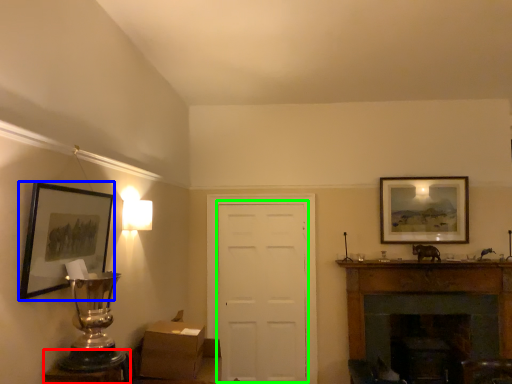
Question: Which object is positioned farthest from table (highlighted by a red box)? Select from picture frame (highlighted by a blue box) and door (highlighted by a green box).

Choices:
 (A) picture frame
 (B) door

Answer: (B)